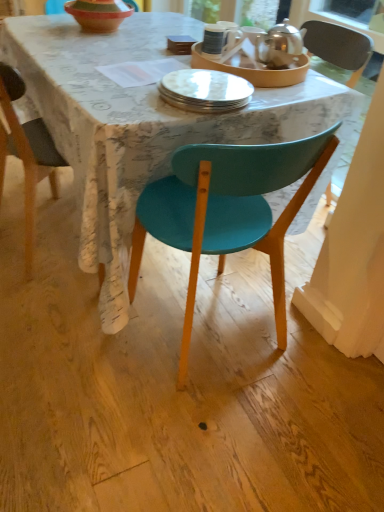
What do you see at coordinates (205, 90) in the screenshot? I see `white glossy plate at center` at bounding box center [205, 90].

What are the coordinates of `white glossy plate at center` in the screenshot? It's located at (205, 90).

Describe the element at coordinates (251, 67) in the screenshot. I see `matte white plate at center, which is counted as the first tableware, starting from the left` at that location.

Measure the distance between point (x=103, y=0) and camera.

The distance of point (x=103, y=0) from camera is 5.43 feet.

From the picture: Measure the distance between teal plastic chair at center and camera.

teal plastic chair at center is 33.98 inches from camera.

Describe the element at coordinates (275, 45) in the screenshot. Image resolution: width=384 pixels, height=512 pixels. I see `polished silver teapot at upper right, the 2th tableware in the left-to-right sequence` at that location.

Locate an element on the screen. This screenshot has width=384, height=512. polished silver teapot at upper right, the 2th tableware in the left-to-right sequence is located at coordinates (275, 45).

What do you see at coordinates (146, 127) in the screenshot?
I see `matte teal chair at center` at bounding box center [146, 127].

You are a GUI agent. You are given a task and a screenshot of the screen. Output one action in this format:
    pyautogui.click(x=<x>, y=<y>)
    Task: Click on the white glossy plate at center
    
    Given the screenshot: What is the action you would take?
    pyautogui.click(x=205, y=90)

Is white glossy mug at upper center further to camera compared to polished silver teapot at upper right, which is counted as the first tableware, starting from the right?

That is True.

From a real-world perspective, is white glossy mug at upper center on top of polished silver teapot at upper right, the 2th tableware in the left-to-right sequence?

Actually, white glossy mug at upper center is physically below polished silver teapot at upper right, the 2th tableware in the left-to-right sequence, in the real world.

Based on the photo, which is farther from the camera, (224, 30) or (267, 64)?

The point (224, 30) is farther from the camera.

What's the angular difference between white glossy mug at upper center and polished silver teapot at upper right, the 2th tableware in the left-to-right sequence,'s facing directions?

They differ by 0.86 degrees in their facing directions.

Image resolution: width=384 pixels, height=512 pixels. What are the coordinates of `coffee cup lying in front of the terracotta clay bowl at upper center` in the screenshot? It's located at (220, 39).

Is white glossy mug at upper center completely or partially outside of terracotta clay bowl at upper center?

white glossy mug at upper center lies outside terracotta clay bowl at upper center's area.

In the image, is white glossy mug at upper center positioned in front of or behind terracotta clay bowl at upper center?

Clearly, white glossy mug at upper center is in front of terracotta clay bowl at upper center.

From the image's perspective, relative to terracotta clay bowl at upper center, is white glossy mug at upper center above or below?

Clearly, from the image's perspective, white glossy mug at upper center is below terracotta clay bowl at upper center.

Would you say matte white plate at center, which is counted as the first tableware, starting from the left, is inside or outside terracotta clay bowl at upper center?

matte white plate at center, which is counted as the first tableware, starting from the left, lies outside terracotta clay bowl at upper center.

Is matte white plate at center, which ranks as the second tableware in right-to-left order, wider than terracotta clay bowl at upper center?

Indeed, matte white plate at center, which ranks as the second tableware in right-to-left order, has a greater width compared to terracotta clay bowl at upper center.

Which object is further away from the camera, matte white plate at center, which ranks as the second tableware in right-to-left order, or terracotta clay bowl at upper center?

terracotta clay bowl at upper center is behind.

Is matte white plate at center, which is counted as the first tableware, starting from the left, at the left side of terracotta clay bowl at upper center?

In fact, matte white plate at center, which is counted as the first tableware, starting from the left, is to the right of terracotta clay bowl at upper center.

Considering the sizes of objects terracotta clay bowl at upper center and white glossy plate at center in the image provided, who is wider, terracotta clay bowl at upper center or white glossy plate at center?

With larger width is terracotta clay bowl at upper center.

Could you tell me if terracotta clay bowl at upper center is turned towards white glossy plate at center?

No, terracotta clay bowl at upper center is not oriented towards white glossy plate at center.

Find the location of a particular element. The height and width of the screenshot is (512, 384). plate below the terracotta clay bowl at upper center (from the image's perspective) is located at coordinates (205, 90).

Could you tell me if matte white plate at center, which is counted as the first tableware, starting from the left, is facing polished silver teapot at upper right, the 2th tableware in the left-to-right sequence?

No, matte white plate at center, which is counted as the first tableware, starting from the left, is not turned towards polished silver teapot at upper right, the 2th tableware in the left-to-right sequence.

Does matte white plate at center, which ranks as the second tableware in right-to-left order, have a larger size compared to polished silver teapot at upper right, which is counted as the first tableware, starting from the right?

Correct, matte white plate at center, which ranks as the second tableware in right-to-left order, is larger in size than polished silver teapot at upper right, which is counted as the first tableware, starting from the right.

Is matte white plate at center, which ranks as the second tableware in right-to-left order, thinner than polished silver teapot at upper right, which is counted as the first tableware, starting from the right?

No, matte white plate at center, which ranks as the second tableware in right-to-left order, is not thinner than polished silver teapot at upper right, which is counted as the first tableware, starting from the right.

Is the position of matte white plate at center, which ranks as the second tableware in right-to-left order, more distant than that of polished silver teapot at upper right, the 2th tableware in the left-to-right sequence?

No, matte white plate at center, which ranks as the second tableware in right-to-left order, is closer to the viewer.

How different are the orientations of white glossy plate at center and polished silver teapot at upper right, the 2th tableware in the left-to-right sequence, in degrees?

white glossy plate at center and polished silver teapot at upper right, the 2th tableware in the left-to-right sequence, are facing 3.83 degrees away from each other.

How much distance is there between white glossy plate at center and polished silver teapot at upper right, which is counted as the first tableware, starting from the right?

33.59 centimeters.

Considering the sizes of objects white glossy plate at center and polished silver teapot at upper right, the 2th tableware in the left-to-right sequence, in the image provided, who is bigger, white glossy plate at center or polished silver teapot at upper right, the 2th tableware in the left-to-right sequence,?

white glossy plate at center is bigger.

Can you confirm if white glossy plate at center is wider than polished silver teapot at upper right, which is counted as the first tableware, starting from the right?

Indeed, white glossy plate at center has a greater width compared to polished silver teapot at upper right, which is counted as the first tableware, starting from the right.

Considering the relative positions of terracotta clay bowl at upper center and matte teal chair at center in the image provided, is terracotta clay bowl at upper center to the left of matte teal chair at center from the viewer's perspective?

Indeed, terracotta clay bowl at upper center is positioned on the left side of matte teal chair at center.

At what (x,y) coordinates should I click in order to perform the action: click on bowl above the matte teal chair at center (from a real-world perspective). Please return your answer as a coordinate pair (x, y). Image resolution: width=384 pixels, height=512 pixels. Looking at the image, I should click on point(98,14).

The width and height of the screenshot is (384, 512). Find the location of `coffee cup located on the left of polished silver teapot at upper right, the 2th tableware in the left-to-right sequence`. coffee cup located on the left of polished silver teapot at upper right, the 2th tableware in the left-to-right sequence is located at coordinates (220, 39).

Locate an element on the screen. coffee cup on the right side of terracotta clay bowl at upper center is located at coordinates (220, 39).

Considering their positions, is terracotta clay bowl at upper center positioned further to white glossy plate at center than teal plastic chair at center?

The object further to white glossy plate at center is terracotta clay bowl at upper center.

Which object lies nearer to the anchor point white glossy plate at center, matte white plate at center, which ranks as the second tableware in right-to-left order, or polished silver teapot at upper right, the 2th tableware in the left-to-right sequence?

Based on the image, matte white plate at center, which ranks as the second tableware in right-to-left order, appears to be nearer to white glossy plate at center.

Looking at the image, which one is located further to matte white plate at center, which ranks as the second tableware in right-to-left order, white glossy mug at upper center or terracotta clay bowl at upper center?

Based on the image, terracotta clay bowl at upper center appears to be further to matte white plate at center, which ranks as the second tableware in right-to-left order.

Based on their spatial positions, is matte teal chair at center or matte white plate at center, which ranks as the second tableware in right-to-left order, closer to terracotta clay bowl at upper center?

Based on the image, matte teal chair at center appears to be nearer to terracotta clay bowl at upper center.

Considering their positions, is matte white plate at center, which ranks as the second tableware in right-to-left order, positioned closer to white glossy plate at center than terracotta clay bowl at upper center?

matte white plate at center, which ranks as the second tableware in right-to-left order, is closer to white glossy plate at center.

Looking at the image, which one is located further to terracotta clay bowl at upper center, matte white plate at center, which ranks as the second tableware in right-to-left order, or white glossy plate at center?

white glossy plate at center.

Considering their positions, is teal plastic chair at center positioned further to polished silver teapot at upper right, which is counted as the first tableware, starting from the right, than terracotta clay bowl at upper center?

teal plastic chair at center is further to polished silver teapot at upper right, which is counted as the first tableware, starting from the right.

Looking at the image, which one is located closer to matte teal chair at center, matte white plate at center, which ranks as the second tableware in right-to-left order, or polished silver teapot at upper right, the 2th tableware in the left-to-right sequence?

Based on the image, matte white plate at center, which ranks as the second tableware in right-to-left order, appears to be nearer to matte teal chair at center.

Where is `plate between polished silver teapot at upper right, the 2th tableware in the left-to-right sequence, and teal plastic chair at center vertically`? Image resolution: width=384 pixels, height=512 pixels. plate between polished silver teapot at upper right, the 2th tableware in the left-to-right sequence, and teal plastic chair at center vertically is located at coordinates (205, 90).

Where is `desk between matte white plate at center, which is counted as the first tableware, starting from the left, and teal plastic chair at center vertically`? desk between matte white plate at center, which is counted as the first tableware, starting from the left, and teal plastic chair at center vertically is located at coordinates (146, 127).

Where is `plate situated between matte teal chair at center and polished silver teapot at upper right, which is counted as the first tableware, starting from the right, from left to right`? This screenshot has width=384, height=512. plate situated between matte teal chair at center and polished silver teapot at upper right, which is counted as the first tableware, starting from the right, from left to right is located at coordinates (205, 90).

Locate an element on the screen. tableware located between matte teal chair at center and polished silver teapot at upper right, which is counted as the first tableware, starting from the right, in the left-right direction is located at coordinates (251, 67).